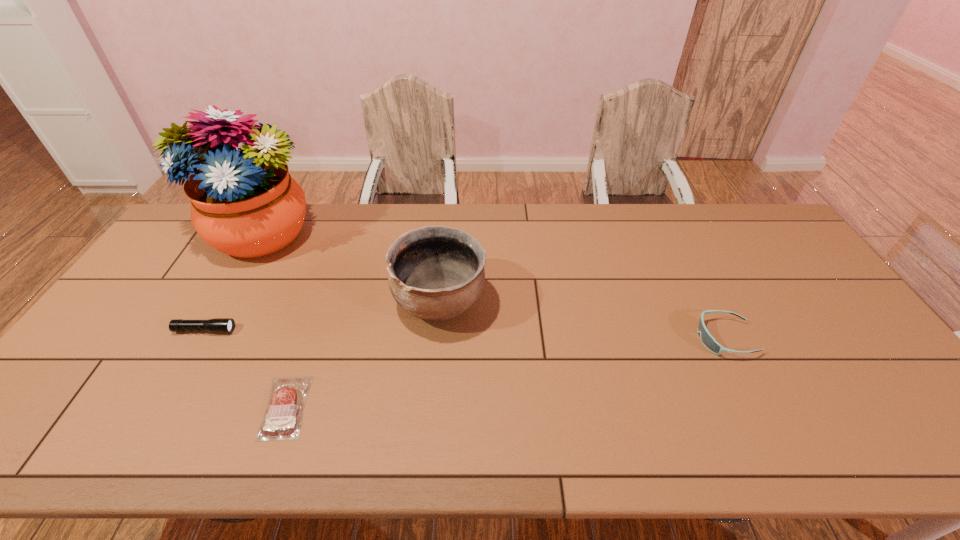
Find the location of `flower arrangement`. flower arrangement is located at coordinates (244, 203).

You are a GUI agent. You are given a task and a screenshot of the screen. Output one action in this format:
    pyautogui.click(x=<x>, y=<y>)
    Task: Click on the second tallest object
    This screenshot has height=540, width=960.
    Given the screenshot: What is the action you would take?
    pyautogui.click(x=435, y=273)

Where is `the second object from right to left`? the second object from right to left is located at coordinates point(435,273).

Locate an element on the screen. The image size is (960, 540). the rightmost object is located at coordinates (709, 342).

At what (x,y) coordinates should I click in order to perform the action: click on goggles. Please return your answer as a coordinate pair (x, y). The image size is (960, 540). Looking at the image, I should click on (709, 342).

The image size is (960, 540). Identify the location of flashlight. (218, 325).

The width and height of the screenshot is (960, 540). I want to click on the nearest object, so click(282, 419).

At what (x,y) coordinates should I click in order to perform the action: click on the third object from right to left. Please return your answer as a coordinate pair (x, y). The image size is (960, 540). Looking at the image, I should click on (282, 419).

What are the coordinates of `vacant space located on the right of the tallest object` in the screenshot? It's located at (399, 234).

This screenshot has height=540, width=960. I want to click on vacant position located 0.200m on the back of the fourth shortest object, so click(x=446, y=231).